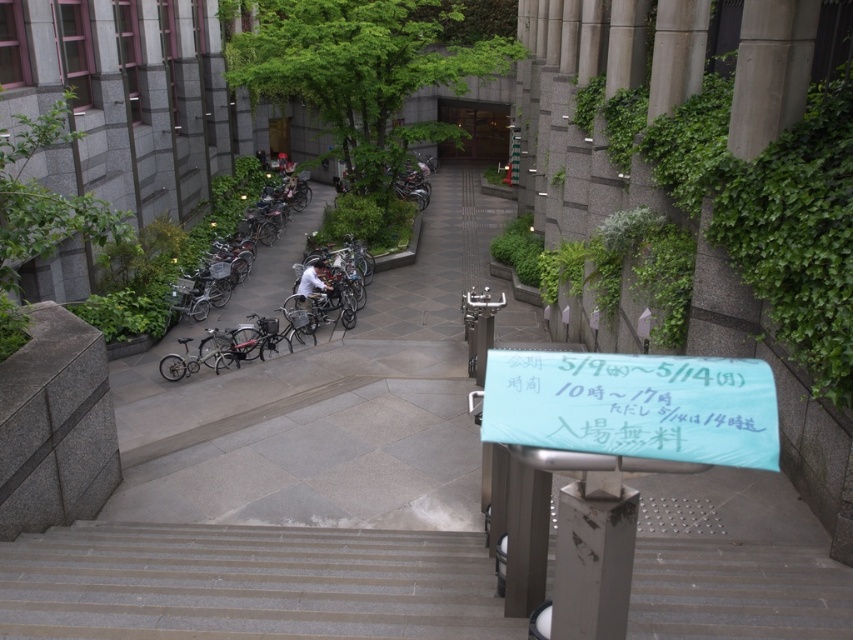
You are standing at the bottom of the stairs in the courtyard and see the teal fabric banner at center and the matte black bicycle at center. Which object is nearer to you?

The teal fabric banner at center is closer to the viewer than the matte black bicycle at center.

You are a delivery person carrying a large package that requires a clear path. You see the gray concrete pavement at center and the matte black bicycle at center. Which one is wider, and can you maneuver your vehicle through it?

The gray concrete pavement at center is wider than the matte black bicycle at center. Since the pavement is wider, you can maneuver your vehicle through the gray concrete pavement at center.